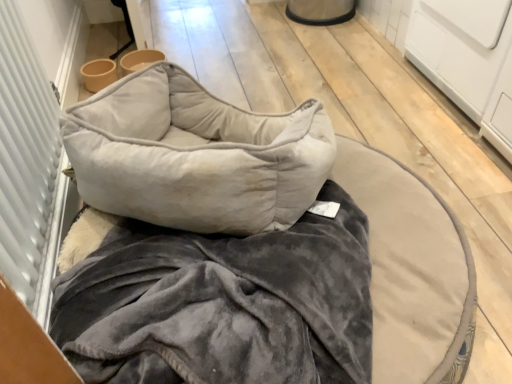
Find the location of `white textured screen door at left`. white textured screen door at left is located at coordinates (28, 168).

What are the coordinates of `velvet gray pillow at center` in the screenshot? It's located at (195, 155).

You are a GUI agent. You are given a task and a screenshot of the screen. Output one action in this format:
    pyautogui.click(x=<x>, y=<y>)
    Task: Click on the white textured screen door at left
    The width and height of the screenshot is (512, 384).
    Given the screenshot: What is the action you would take?
    tap(28, 168)

Looking at this image, looking at the image, does velvet gray pet bed at center seem bigger or smaller compared to white textured screen door at left?

Clearly, velvet gray pet bed at center is larger in size than white textured screen door at left.

Considering the relative positions of velvet gray pet bed at center and white textured screen door at left in the image provided, is velvet gray pet bed at center to the left of white textured screen door at left from the viewer's perspective?

No.

Is velvet gray pet bed at center in front of or behind white textured screen door at left in the image?

velvet gray pet bed at center is behind white textured screen door at left.

Does velvet gray pet bed at center have a greater height compared to white textured screen door at left?

In fact, velvet gray pet bed at center may be shorter than white textured screen door at left.

Image resolution: width=512 pixels, height=384 pixels. In order to click on pillow above the velvet gray pet bed at center (from a real-world perspective) in this screenshot , I will do `click(195, 155)`.

In the scene shown: Considering the relative sizes of velvet gray pillow at center and velvet gray pet bed at center in the image provided, is velvet gray pillow at center bigger than velvet gray pet bed at center?

Actually, velvet gray pillow at center might be smaller than velvet gray pet bed at center.

Between velvet gray pillow at center and velvet gray pet bed at center, which one appears on the left side from the viewer's perspective?

From the viewer's perspective, velvet gray pillow at center appears more on the left side.

Would you say velvet gray pillow at center contains velvet gray pet bed at center?

Actually, velvet gray pet bed at center is outside velvet gray pillow at center.

Is velvet gray pillow at center completely or partially outside of white textured screen door at left?

Yes, velvet gray pillow at center is located beyond the bounds of white textured screen door at left.

How different are the orientations of velvet gray pillow at center and white textured screen door at left in degrees?

65.9 degrees.

The image size is (512, 384). What are the coordinates of `screen door that is on the left side of velvet gray pillow at center` in the screenshot? It's located at (28, 168).

Considering the positions of points (101, 182) and (66, 184), is point (101, 182) farther from camera compared to point (66, 184)?

No, it is in front of (66, 184).

Is white textured screen door at left in front of or behind velvet gray pillow at center in the image?

Clearly, white textured screen door at left is in front of velvet gray pillow at center.

Is white textured screen door at left at the left side of velvet gray pillow at center?

Yes.

From a real-world perspective, is white textured screen door at left positioned above or below velvet gray pillow at center?

white textured screen door at left is above velvet gray pillow at center.

Could you tell me if white textured screen door at left is turned towards velvet gray pillow at center?

Yes, white textured screen door at left is turned towards velvet gray pillow at center.

From the image's perspective, which object appears higher, velvet gray pet bed at center or velvet gray pillow at center?

velvet gray pillow at center, from the image's perspective.

Which object is thinner, velvet gray pet bed at center or velvet gray pillow at center?

With smaller width is velvet gray pillow at center.

Considering the positions of objects velvet gray pet bed at center and velvet gray pillow at center in the image provided, who is behind, velvet gray pet bed at center or velvet gray pillow at center?

velvet gray pillow at center.

How many degrees apart are the facing directions of velvet gray pet bed at center and velvet gray pillow at center?

They differ by 66.3 degrees in their facing directions.

Could you tell me if white textured screen door at left is facing velvet gray pet bed at center?

Yes.

Are white textured screen door at left and velvet gray pet bed at center making contact?

No, white textured screen door at left is not making contact with velvet gray pet bed at center.

From the image's perspective, between white textured screen door at left and velvet gray pet bed at center, who is located below?

velvet gray pet bed at center.

Is white textured screen door at left wider or thinner than velvet gray pet bed at center?

Clearly, white textured screen door at left has less width compared to velvet gray pet bed at center.

What are the coordinates of `furniture below the white textured screen door at left (from the image's perspective)` in the screenshot? It's located at (249, 247).

The width and height of the screenshot is (512, 384). In the image, there is a velvet gray pet bed at center. In order to click on pillow above it (from the image's perspective) in this screenshot , I will do `click(195, 155)`.

Considering their positions, is velvet gray pillow at center positioned closer to white textured screen door at left than velvet gray pet bed at center?

velvet gray pillow at center lies closer to white textured screen door at left than the other object.

Considering their positions, is white textured screen door at left positioned closer to velvet gray pillow at center than velvet gray pet bed at center?

velvet gray pet bed at center.

Looking at the image, which one is located further to white textured screen door at left, velvet gray pet bed at center or velvet gray pillow at center?

velvet gray pet bed at center is further to white textured screen door at left.

Estimate the real-world distances between objects in this image. Which object is further from velvet gray pet bed at center, white textured screen door at left or velvet gray pillow at center?

Answer: The object further to velvet gray pet bed at center is white textured screen door at left.

When comparing their distances from velvet gray pillow at center, does velvet gray pet bed at center or white textured screen door at left seem further?

white textured screen door at left is positioned further to the anchor velvet gray pillow at center.

Looking at the image, which one is located closer to velvet gray pet bed at center, velvet gray pillow at center or white textured screen door at left?

velvet gray pillow at center is positioned closer to the anchor velvet gray pet bed at center.

Identify the location of pillow situated between white textured screen door at left and velvet gray pet bed at center from left to right. The height and width of the screenshot is (384, 512). (195, 155).